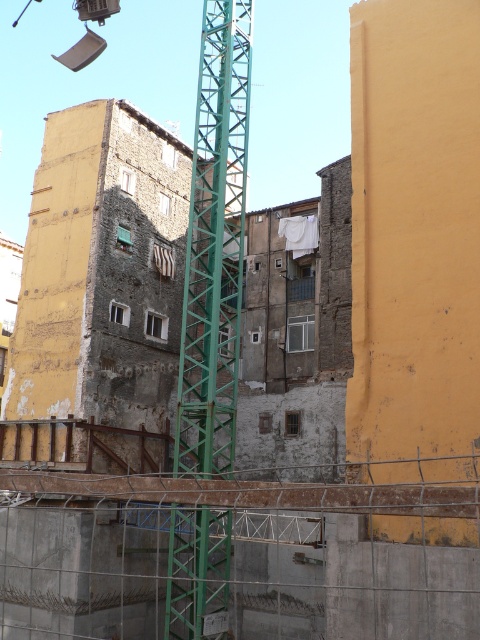
You are a construction worker standing at point (228, 550). What object are you standing on?

You are standing on the green metal tower crane at center located at point (228, 550).

You are a construction worker who needs to move a heavy beam from the ground to the upper floor of the partially completed building. Which crane should you use between the green metal tower crane at center and the green metallic tower crane at center?

The green metal tower crane at center is larger in size than the green metallic tower crane at center, so you should use the green metal tower crane at center to move the heavy beam as it can handle heavier loads due to its larger size.

You are a construction worker standing at the camera position. There is a point marked at coordinates (396,518) in the image. Can you safely walk to that point without needing to move any construction equipment?

The point at (396,518) is 69.46 feet away from your current position. Since there is no mention of obstacles or equipment blocking the path in the scene description, you can likely walk to that point safely.